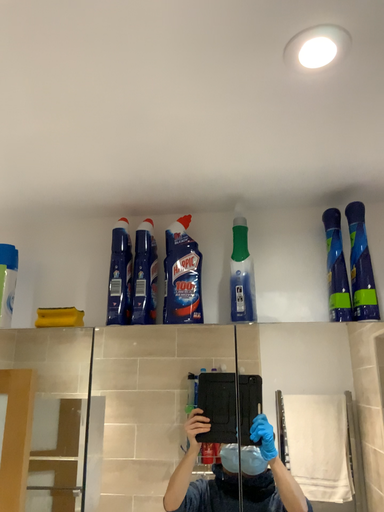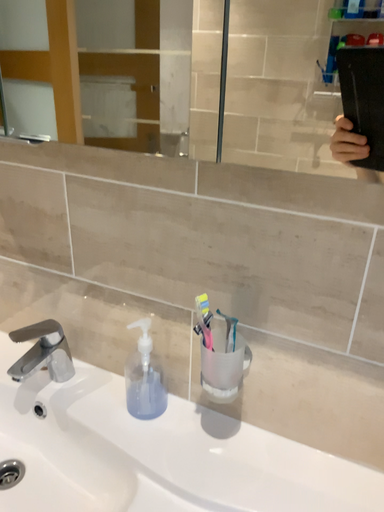
Question: How did the camera likely rotate when shooting the video?

Choices:
 (A) rotated left
 (B) rotated right

Answer: (A)